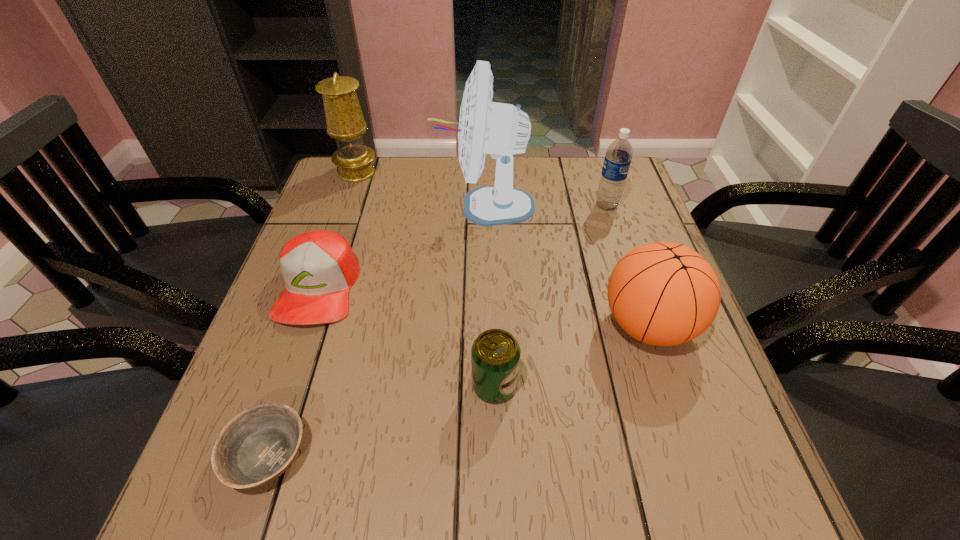
Locate an element on the screen. blank space at the near edge of the desktop is located at coordinates (310, 464).

Where is `blank space at the left edge of the desktop`? blank space at the left edge of the desktop is located at coordinates (326, 364).

Image resolution: width=960 pixels, height=540 pixels. In the image, there is a desktop. What are the coordinates of `vacant region at the right edge` in the screenshot? It's located at (620, 220).

Identify the location of unoccupied area between the water bottle and the fan. This screenshot has width=960, height=540. [x=546, y=206].

This screenshot has width=960, height=540. Identify the location of free space between the second tallest object and the beer can. (425, 279).

This screenshot has width=960, height=540. Identify the location of free spot between the water bottle and the tallest object. (546, 206).

The height and width of the screenshot is (540, 960). What are the coordinates of `empty space between the oil lamp and the beer can` in the screenshot? It's located at (425, 279).

In order to click on free area in between the fan and the water bottle in this screenshot , I will do `click(546, 206)`.

Find the location of a particular element. free space between the baseball cap and the water bottle is located at coordinates (463, 247).

Where is `free space between the baseball cap and the tallest object`? Image resolution: width=960 pixels, height=540 pixels. free space between the baseball cap and the tallest object is located at coordinates (402, 247).